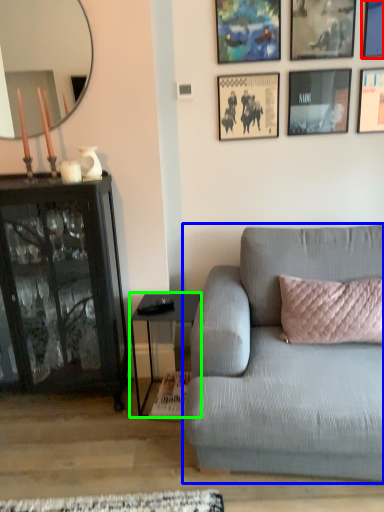
Question: Considering the real-world distances, which object is closest to picture frame (highlighted by a red box)? studio couch (highlighted by a blue box) or table (highlighted by a green box).

Choices:
 (A) studio couch
 (B) table

Answer: (A)